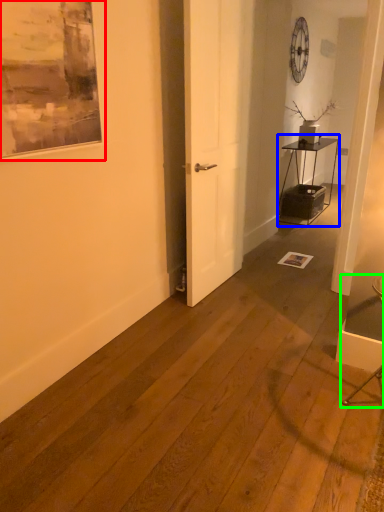
Question: Based on their relative distances, which object is farther from picture frame (highlighted by a red box)? Choose from table (highlighted by a blue box) and armchair (highlighted by a green box).

Choices:
 (A) table
 (B) armchair

Answer: (A)